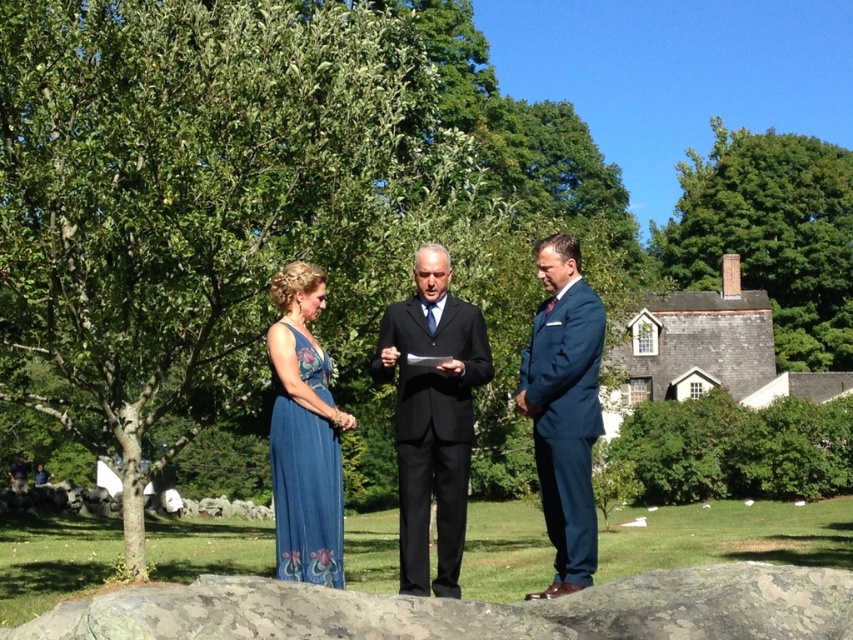
Is matte blue dress at center taller than black suit at center?

Incorrect, matte blue dress at center's height is not larger of black suit at center's.

Does matte blue dress at center appear on the left side of black suit at center?

Incorrect, matte blue dress at center is not on the left side of black suit at center.

Between point (427, 305) and point (401, 534), which one is positioned in front?

Positioned in front is point (401, 534).

At what (x,y) coordinates should I click in order to perform the action: click on matte blue dress at center. Please return your answer as a coordinate pair (x, y). The width and height of the screenshot is (853, 640). Looking at the image, I should click on (432, 417).

Does point (782, 294) come closer to viewer compared to point (416, 506)?

No.

Is green leafy tree at upper right bigger than matte blue dress at center?

Indeed, green leafy tree at upper right has a larger size compared to matte blue dress at center.

Does point (775, 289) come closer to viewer compared to point (431, 477)?

That is False.

At what (x,y) coordinates should I click in order to perform the action: click on green leafy tree at upper right. Please return your answer as a coordinate pair (x, y). Image resolution: width=853 pixels, height=640 pixels. Looking at the image, I should click on (770, 236).

Which of these two, green leafy tree at center or blue satin dress at center, stands taller?

With more height is green leafy tree at center.

Does green leafy tree at center appear on the left side of blue satin dress at center?

Indeed, green leafy tree at center is positioned on the left side of blue satin dress at center.

Between point (170, 417) and point (335, 504), which one is positioned behind?

The point (170, 417) is behind.

What are the coordinates of `green leafy tree at center` in the screenshot? It's located at (204, 202).